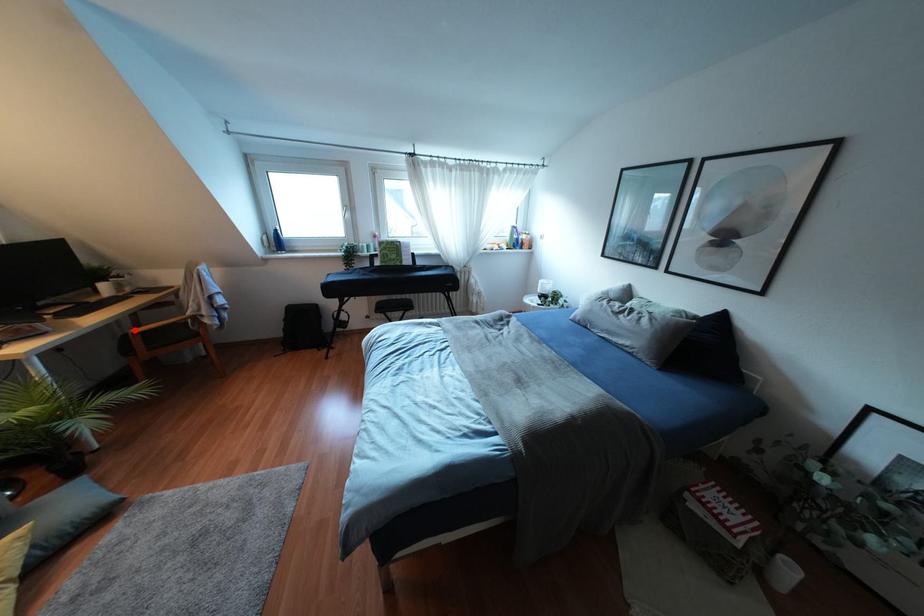
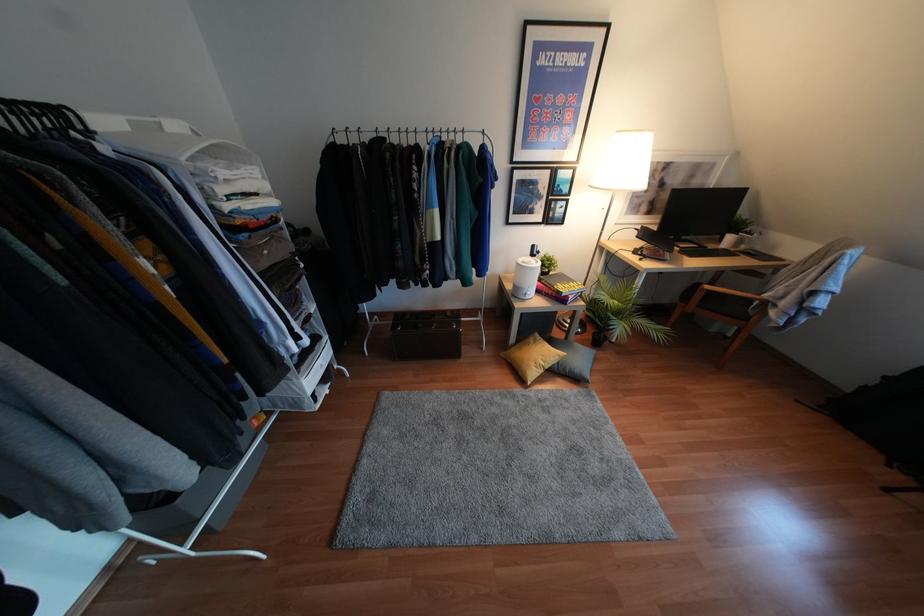
Question: I am providing you with two images of the same scene from different viewpoints. A red point is marked on the first image. Can you still see the location of the red point in image 2?

Choices:
 (A) Yes
 (B) No

Answer: (A)